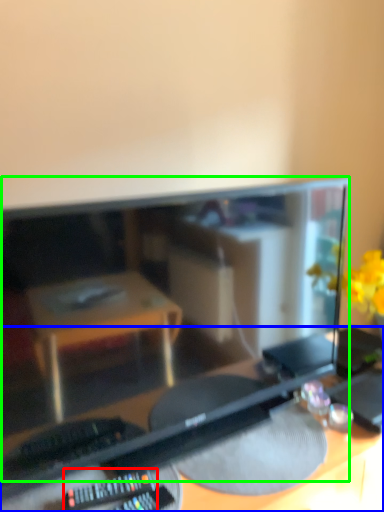
Question: Considering the real-world distances, which object is farthest from control (highlighted by a red box)? desk (highlighted by a blue box) or computer monitor (highlighted by a green box)?

Choices:
 (A) desk
 (B) computer monitor

Answer: (B)